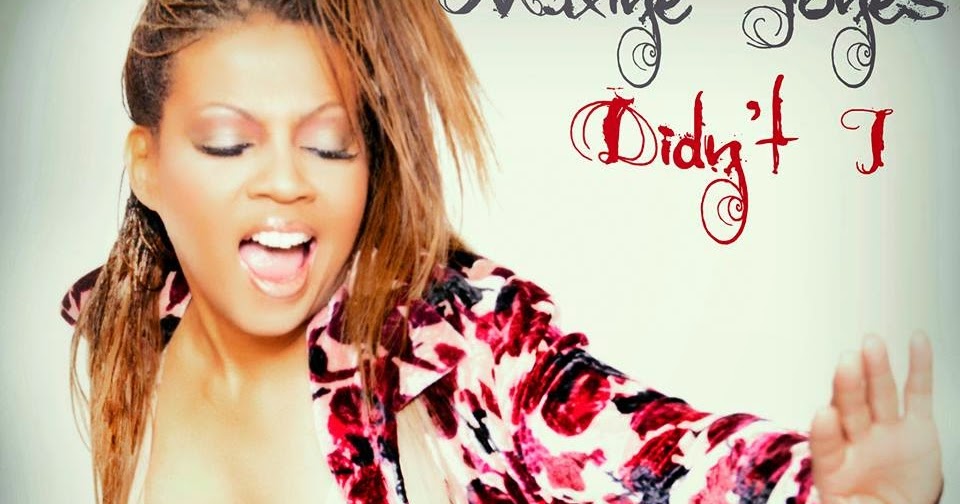
The height and width of the screenshot is (504, 960). I want to click on wall, so click(60, 155).